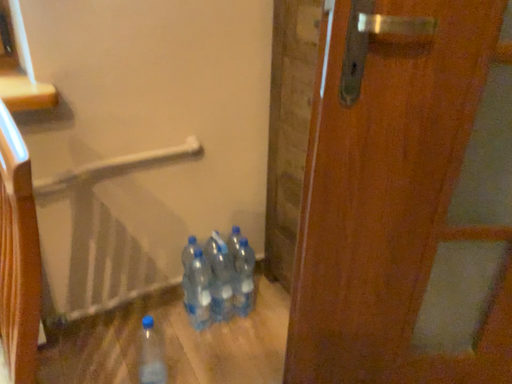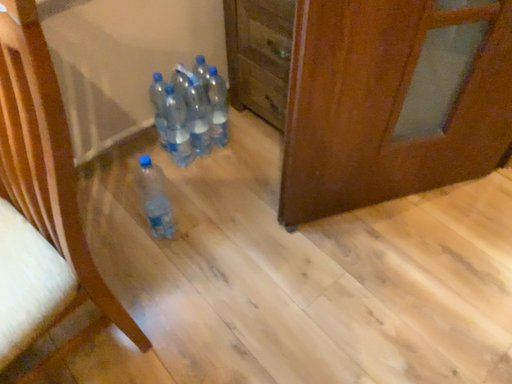
Question: How did the camera likely rotate when shooting the video?

Choices:
 (A) rotated downward
 (B) rotated upward

Answer: (A)